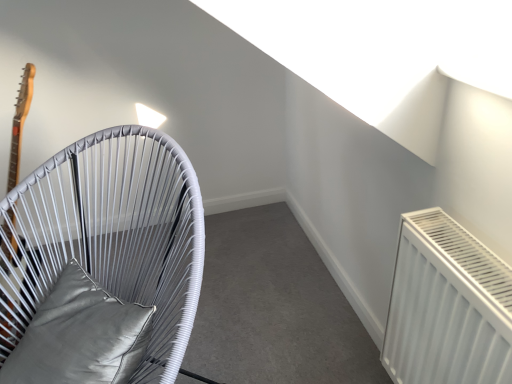
Question: Can you confirm if satin gray pillow at left is bigger than white woven chair at left?

Choices:
 (A) yes
 (B) no

Answer: (B)

Question: From a real-world perspective, does satin gray pillow at left stand above white woven chair at left?

Choices:
 (A) yes
 (B) no

Answer: (A)

Question: Is satin gray pillow at left completely or partially outside of white woven chair at left?

Choices:
 (A) no
 (B) yes

Answer: (A)

Question: Is satin gray pillow at left shorter than white woven chair at left?

Choices:
 (A) no
 (B) yes

Answer: (B)

Question: Is satin gray pillow at left far away from white woven chair at left?

Choices:
 (A) yes
 (B) no

Answer: (B)

Question: Can you confirm if satin gray pillow at left is taller than white woven chair at left?

Choices:
 (A) yes
 (B) no

Answer: (B)

Question: Can you confirm if white woven chair at left is bigger than satin gray pillow at left?

Choices:
 (A) yes
 (B) no

Answer: (A)

Question: Does white woven chair at left have a greater width compared to satin gray pillow at left?

Choices:
 (A) no
 (B) yes

Answer: (B)

Question: Is white woven chair at left further to the viewer compared to satin gray pillow at left?

Choices:
 (A) yes
 (B) no

Answer: (B)

Question: Is white woven chair at left facing away from satin gray pillow at left?

Choices:
 (A) yes
 (B) no

Answer: (A)

Question: Can you confirm if white woven chair at left is taller than satin gray pillow at left?

Choices:
 (A) no
 (B) yes

Answer: (B)

Question: Is white woven chair at left positioned far away from satin gray pillow at left?

Choices:
 (A) no
 (B) yes

Answer: (A)

Question: Based on their positions, is satin gray pillow at left located to the left or right of white woven chair at left?

Choices:
 (A) left
 (B) right

Answer: (B)